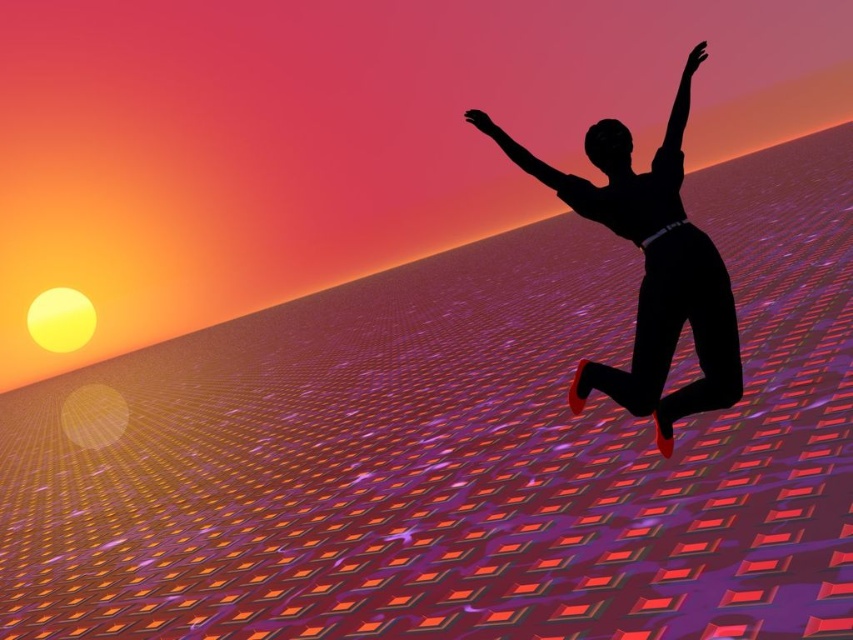
You are an observer looking at the surreal scene. You notice the black matte figure at upper right and the black matte arm at upper right. Which object is positioned lower in the image?

The black matte figure at upper right is located below the black matte arm at upper right, so the black matte figure at upper right is positioned lower in the image.

You are an artist analyzing the composition of the image. You notice the black matte figure at upper right and the black matte arm at upper right. Which object appears larger in the scene?

The black matte arm at upper right is larger than the black matte figure at upper right.